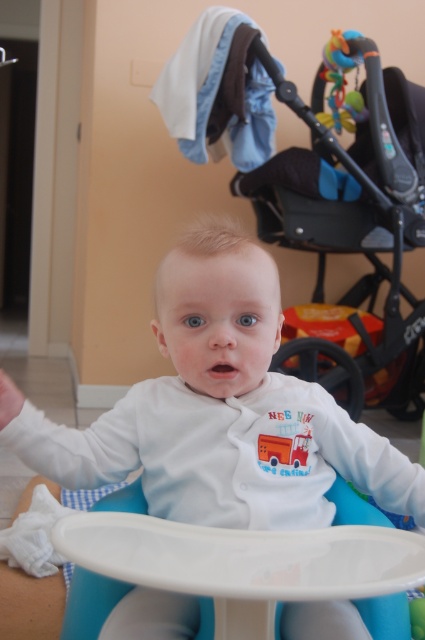
Between white soft baby at center and rubberized plastic teething toy at upper right, which one is positioned higher?

rubberized plastic teething toy at upper right

Between point (337, 467) and point (328, 48), which one is positioned behind?

Positioned behind is point (328, 48).

Is point (275, 516) positioned before point (333, 88)?

Yes, it is.

The width and height of the screenshot is (425, 640). I want to click on white soft baby at center, so click(x=218, y=410).

Does black plastic baby carriage at upper center appear on the left side of white plastic table at center?

In fact, black plastic baby carriage at upper center is to the right of white plastic table at center.

Does point (356, 193) come farther from viewer compared to point (110, 600)?

That is True.

Where is `black plastic baby carriage at upper center`? This screenshot has height=640, width=425. black plastic baby carriage at upper center is located at coordinates pyautogui.click(x=272, y=136).

Is point (169, 442) positioned behind point (173, 129)?

No, (169, 442) is in front of (173, 129).

Is point (183, 268) in front of point (333, 220)?

Yes, it is.

Measure the distance between point (183, 330) and camera.

A distance of 36.42 inches exists between point (183, 330) and camera.

Where is `white soft baby at center`? white soft baby at center is located at coordinates (218, 410).